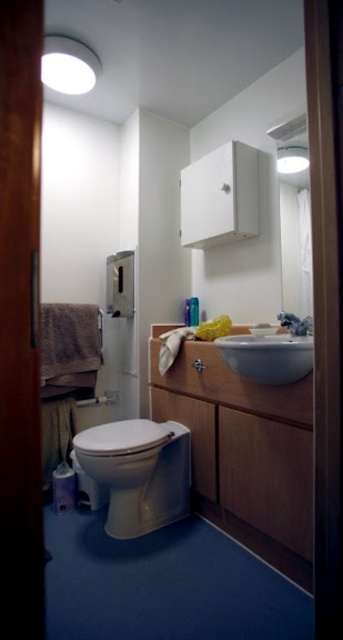
Who is positioned more to the left, wooden vanity at center or white glossy toilet bowl at center?

Positioned to the left is white glossy toilet bowl at center.

Can you confirm if wooden vanity at center is positioned above white glossy toilet bowl at center?

Correct, wooden vanity at center is located above white glossy toilet bowl at center.

Image resolution: width=343 pixels, height=640 pixels. I want to click on wooden vanity at center, so click(x=242, y=440).

What do you see at coordinates (138, 472) in the screenshot?
I see `white glossy toilet bowl at center` at bounding box center [138, 472].

Who is taller, white glossy toilet bowl at center or satin silver faucet at sink right?

Standing taller between the two is white glossy toilet bowl at center.

Is point (171, 454) positioned in front of point (279, 316)?

No.

Image resolution: width=343 pixels, height=640 pixels. I want to click on white glossy toilet bowl at center, so click(138, 472).

Does point (285, 406) come closer to viewer compared to point (232, 355)?

No, (285, 406) is further to viewer.

Can you confirm if wooden vanity at center is positioned to the left of white glossy sink at center?

Yes, wooden vanity at center is to the left of white glossy sink at center.

Does point (198, 369) come closer to viewer compared to point (309, 369)?

No, (198, 369) is further to viewer.

Where is `wooden vanity at center`? Image resolution: width=343 pixels, height=640 pixels. wooden vanity at center is located at coordinates (242, 440).